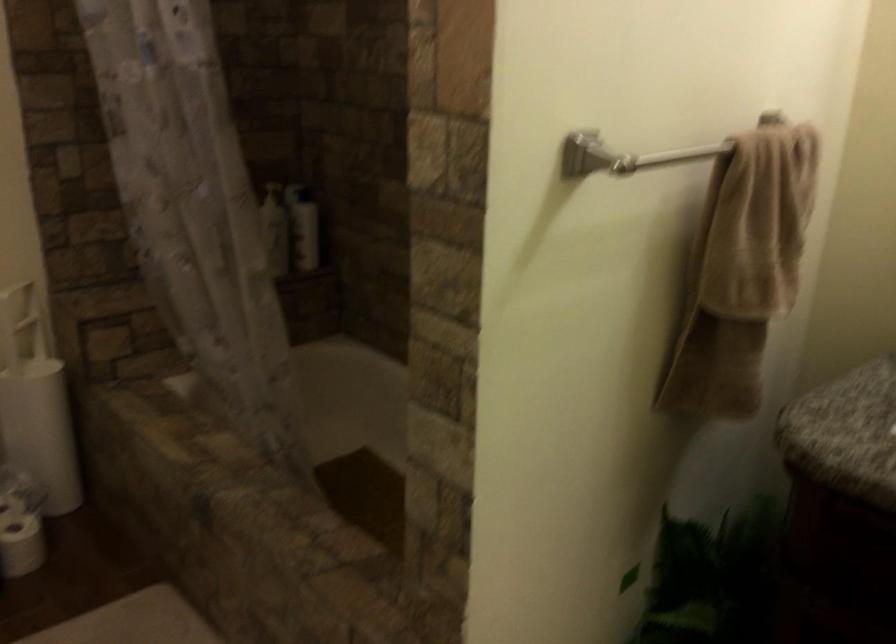
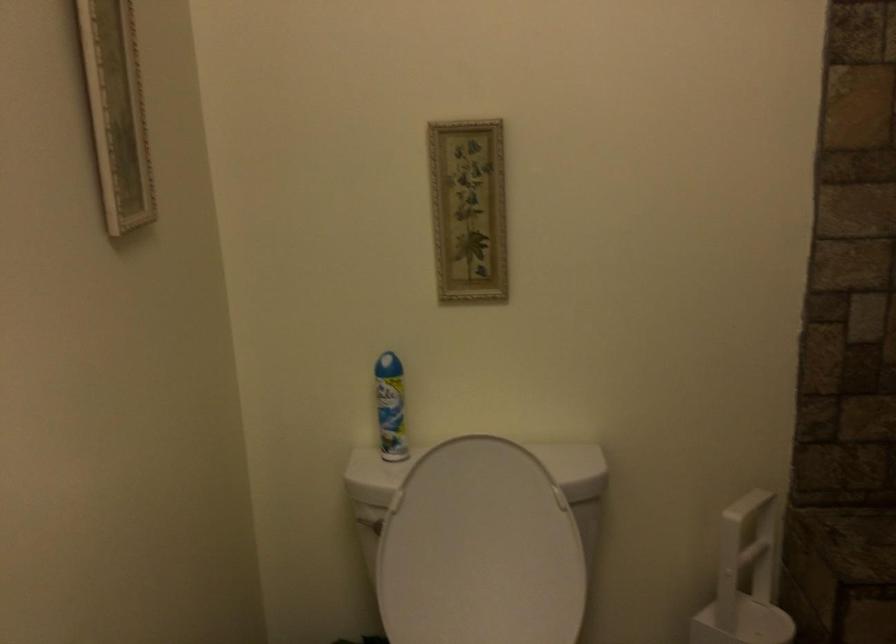
Question: The camera is either moving clockwise (left) or counter-clockwise (right) around the object. The first image is from the beginning of the video and the second image is from the end. Is the camera moving left or right when shooting the video?

Choices:
 (A) Left
 (B) Right

Answer: (B)